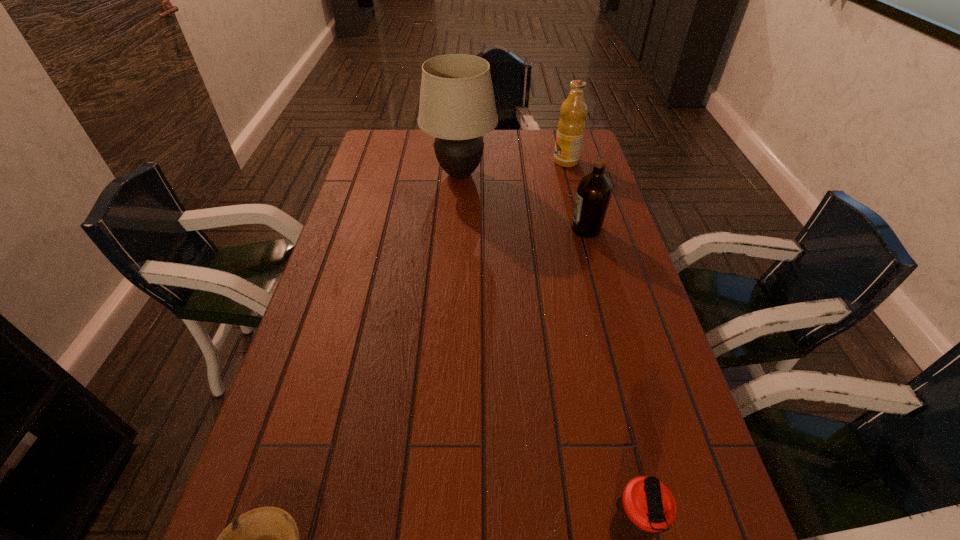
I want to click on free region located 0.380m on the label of the shorter olive oil, so click(444, 230).

Find the location of a particular element. Image resolution: width=960 pixels, height=540 pixels. free space located 0.390m on the label of the shorter olive oil is located at coordinates (441, 230).

At what (x,y) coordinates should I click in order to perform the action: click on vacant space situated on the label of the shorter olive oil. Please return your answer as a coordinate pair (x, y). Image resolution: width=960 pixels, height=540 pixels. Looking at the image, I should click on (503, 230).

What are the coordinates of `lampshade at the far edge` in the screenshot? It's located at (457, 106).

Identify the location of olive oil at the far edge. (571, 127).

What are the coordinates of `object at the far right corner` in the screenshot? It's located at (571, 127).

In the image, there is a desktop. Where is `free space at the left edge`? Image resolution: width=960 pixels, height=540 pixels. free space at the left edge is located at coordinates (339, 435).

In the image, there is a desktop. Where is `vacant region at the right edge`? This screenshot has width=960, height=540. vacant region at the right edge is located at coordinates (605, 397).

The image size is (960, 540). Find the location of `vacant area at the far left corner of the desktop`. vacant area at the far left corner of the desktop is located at coordinates (396, 136).

In order to click on vacant region between the third nearest object and the fourth object from right to left in this screenshot , I will do `click(523, 202)`.